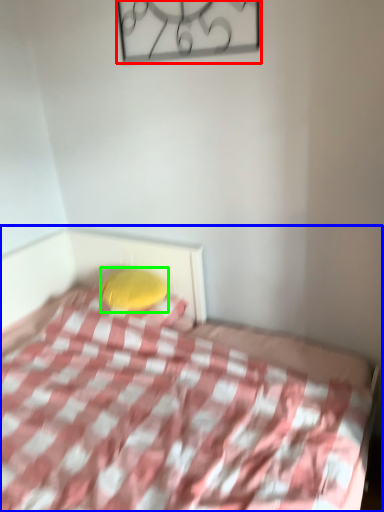
Question: Which object is the farthest from design (highlighted by a red box)? Choose among these: bed (highlighted by a blue box) or pillow (highlighted by a green box).

Choices:
 (A) bed
 (B) pillow

Answer: (A)